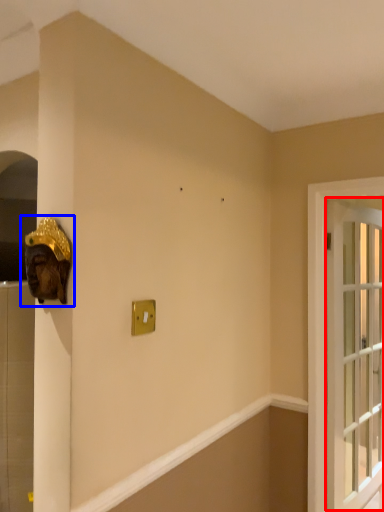
Question: Which point is closer to the camera, window (highlighted by a red box) or sculpture (highlighted by a blue box)?

Choices:
 (A) window
 (B) sculpture

Answer: (B)